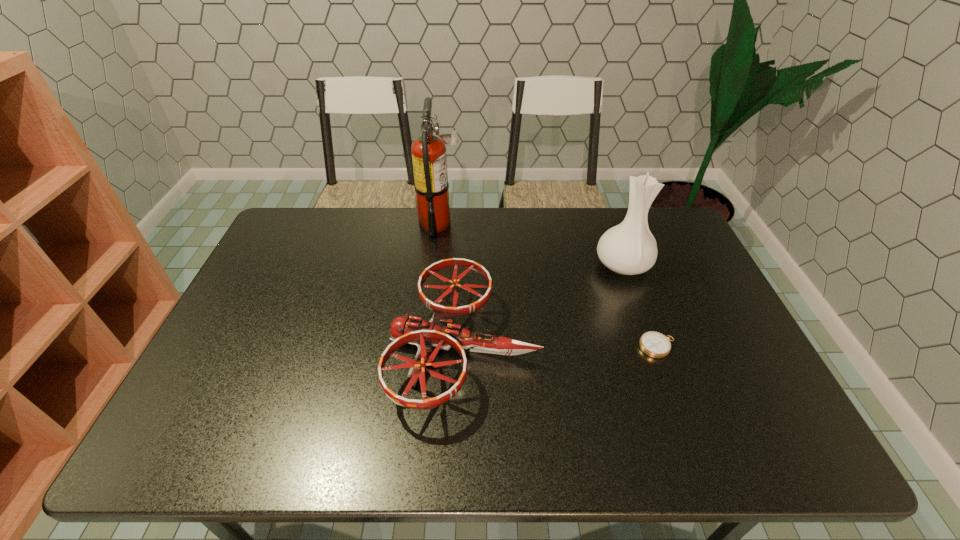
The width and height of the screenshot is (960, 540). I want to click on fire extinguisher located at the far edge, so (429, 159).

Locate an element on the screen. The image size is (960, 540). vase located at the far edge is located at coordinates click(629, 248).

Find the location of a particular element. The height and width of the screenshot is (540, 960). object at the near edge is located at coordinates (440, 332).

Locate an element on the screen. object that is at the right edge is located at coordinates (629, 248).

Where is `object located in the far right corner section of the desktop`? The width and height of the screenshot is (960, 540). object located in the far right corner section of the desktop is located at coordinates (629, 248).

In order to click on free space at the far edge in this screenshot , I will do click(x=564, y=212).

Where is `blank space at the near edge of the desktop`? This screenshot has height=540, width=960. blank space at the near edge of the desktop is located at coordinates (289, 437).

Where is `free space at the left edge of the desktop`? free space at the left edge of the desktop is located at coordinates (275, 296).

You are a GUI agent. You are given a task and a screenshot of the screen. Output one action in this format:
    pyautogui.click(x=<x>, y=<y>)
    Task: Click on the vacant space at the right edge of the desktop
    This screenshot has height=540, width=960.
    Given the screenshot: What is the action you would take?
    pyautogui.click(x=674, y=301)

This screenshot has width=960, height=540. In the image, there is a desktop. Find the location of `vacant space at the far right corner`. vacant space at the far right corner is located at coordinates (663, 242).